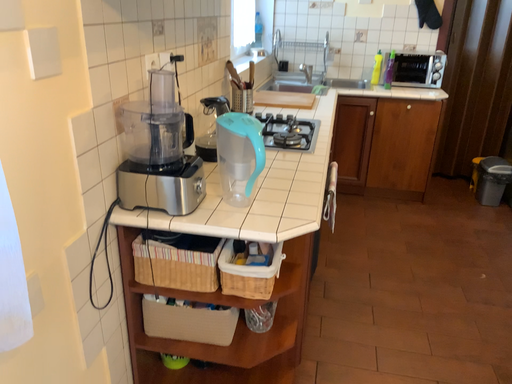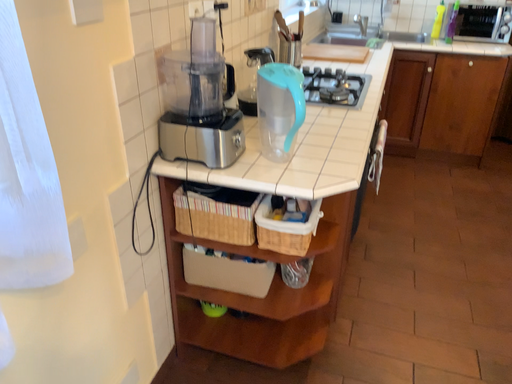
Question: Which way did the camera rotate in the video?

Choices:
 (A) rotated left
 (B) rotated right

Answer: (A)